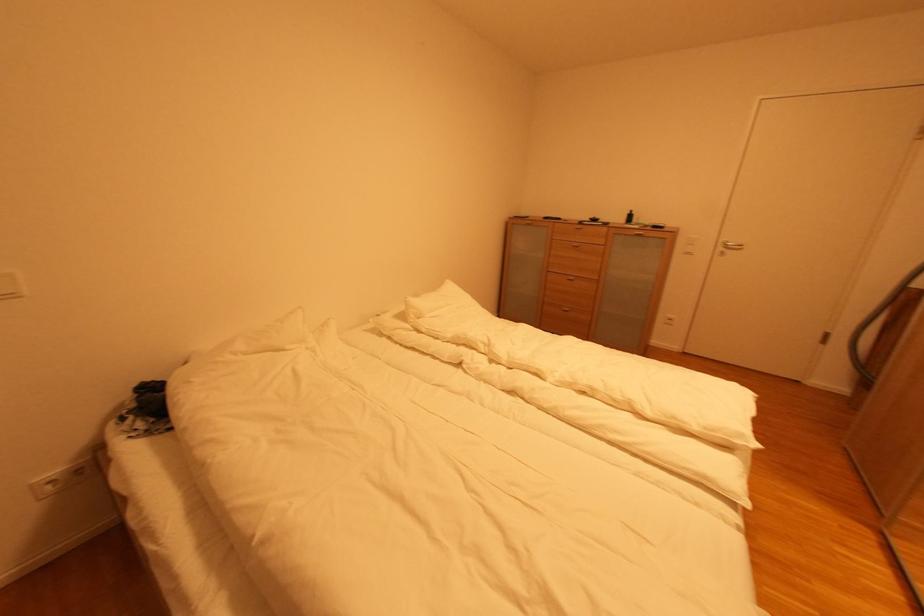
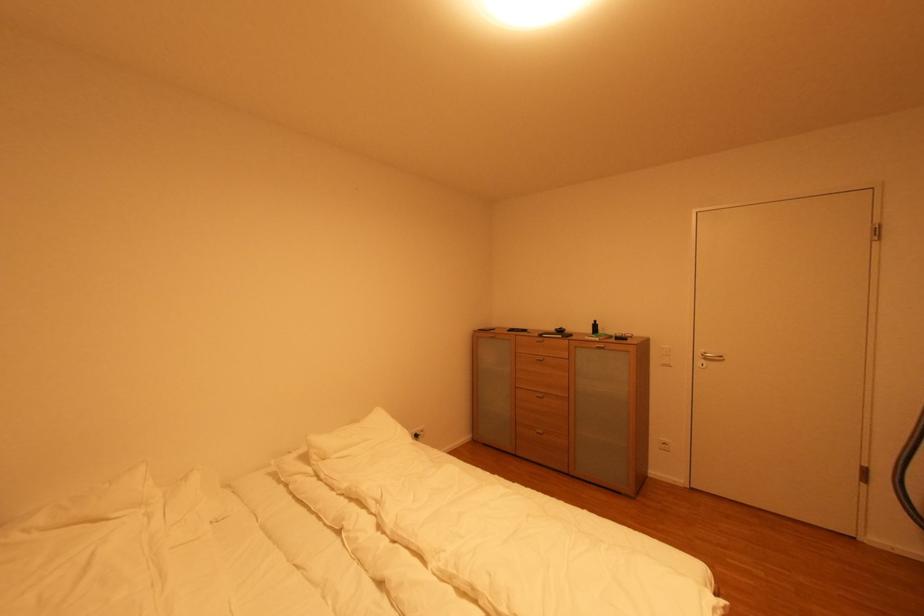
The point at (423, 320) is marked in the first image. Where is the corresponding point in the second image?

(330, 461)